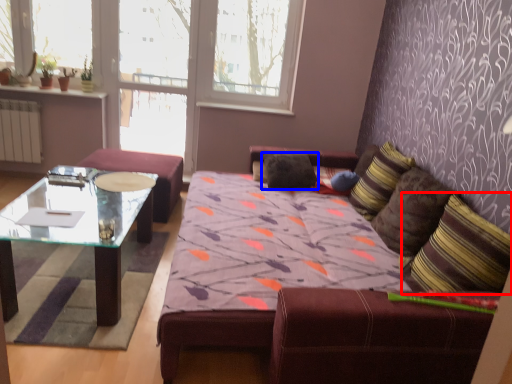
Question: Which object appears closest to the camera in this image, throw pillow (highlighted by a red box) or pillow (highlighted by a blue box)?

Choices:
 (A) throw pillow
 (B) pillow

Answer: (A)